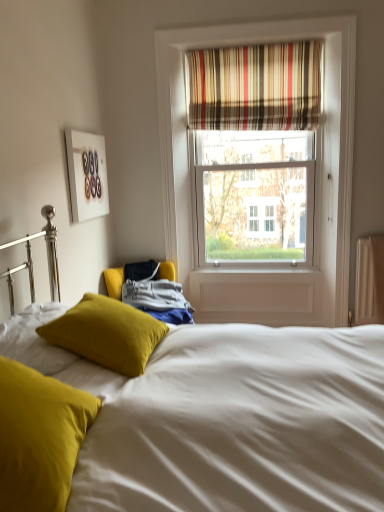
The height and width of the screenshot is (512, 384). What are the coordinates of `velvet mustard pillow at center, positioned as the 1th pillow in back-to-front order` in the screenshot? It's located at (107, 334).

Image resolution: width=384 pixels, height=512 pixels. Describe the element at coordinates (255, 87) in the screenshot. I see `striped fabric curtain at upper center` at that location.

What are the coordinates of `striped fabric curtain at upper center` in the screenshot? It's located at (255, 87).

At what (x,y) coordinates should I click in order to perform the action: click on white matte picture frame at upper left. Please return your answer as a coordinate pair (x, y). The width and height of the screenshot is (384, 512). Looking at the image, I should click on (87, 175).

Does point (192, 58) lie in front of point (250, 424)?

No.

Considering the sizes of objects striped fabric curtain at upper center and velvet yellow pillow at center in the image provided, who is wider, striped fabric curtain at upper center or velvet yellow pillow at center?

Wider between the two is velvet yellow pillow at center.

From a real-world perspective, relative to velvet yellow pillow at center, is striped fabric curtain at upper center vertically above or below?

striped fabric curtain at upper center is situated higher than velvet yellow pillow at center in the real world.

What's the angular difference between striped fabric curtain at upper center and velvet yellow pillow at center's facing directions?

The angular difference between striped fabric curtain at upper center and velvet yellow pillow at center is 89.6 degrees.

From a real-world perspective, is white matte picture frame at upper left physically below velvet mustard pillow at center, positioned as the 1th pillow in back-to-front order?

No, from a real-world perspective, white matte picture frame at upper left is not under velvet mustard pillow at center, positioned as the 1th pillow in back-to-front order.

In the scene shown: Considering the positions of objects white matte picture frame at upper left and velvet mustard pillow at center, positioned as the 1th pillow in back-to-front order, in the image provided, who is behind, white matte picture frame at upper left or velvet mustard pillow at center, positioned as the 1th pillow in back-to-front order,?

white matte picture frame at upper left.

Does point (83, 214) come behind point (100, 323)?

Yes, it is.

Between white matte picture frame at upper left and velvet mustard pillow at center, positioned as the 1th pillow in back-to-front order, which one has smaller size?

With smaller size is white matte picture frame at upper left.

Find the location of a particular element. curtain that is on the right side of velvet yellow pillow at center is located at coordinates (255, 87).

Which object is closer to the camera, velvet yellow pillow at center or striped fabric curtain at upper center?

velvet yellow pillow at center is in front.

Are velvet yellow pillow at center and striped fabric curtain at upper center beside each other?

velvet yellow pillow at center is not next to striped fabric curtain at upper center, and they're not touching.

From the image's perspective, who appears lower, matte yellow pillow at lower left, the first pillow when ordered from front to back, or striped fabric curtain at upper center?

matte yellow pillow at lower left, the first pillow when ordered from front to back, appears lower in the image.

Is matte yellow pillow at lower left, the 2th pillow in the back-to-front sequence, in front of or behind striped fabric curtain at upper center in the image?

Visually, matte yellow pillow at lower left, the 2th pillow in the back-to-front sequence, is located in front of striped fabric curtain at upper center.

This screenshot has width=384, height=512. There is a striped fabric curtain at upper center. Identify the location of the 2nd pillow below it (from the image's perspective). (x=39, y=437).

Is matte yellow pillow at lower left, the 2th pillow in the back-to-front sequence, at the left side of striped fabric curtain at upper center?

Correct, you'll find matte yellow pillow at lower left, the 2th pillow in the back-to-front sequence, to the left of striped fabric curtain at upper center.

Is point (321, 85) behind point (92, 194)?

Yes, point (321, 85) is behind point (92, 194).

Considering the relative sizes of striped fabric curtain at upper center and white matte picture frame at upper left in the image provided, is striped fabric curtain at upper center wider than white matte picture frame at upper left?

Correct, the width of striped fabric curtain at upper center exceeds that of white matte picture frame at upper left.

Who is more distant, striped fabric curtain at upper center or white matte picture frame at upper left?

striped fabric curtain at upper center is further from the camera.

Consider the image. Which is correct: striped fabric curtain at upper center is inside white matte picture frame at upper left, or outside of it?

striped fabric curtain at upper center cannot be found inside white matte picture frame at upper left.

This screenshot has width=384, height=512. What are the coordinates of `picture frame that appears above the matte yellow pillow at lower left, the 2th pillow in the back-to-front sequence (from the image's perspective)` in the screenshot? It's located at (87, 175).

Is matte yellow pillow at lower left, the 2th pillow in the back-to-front sequence, aimed at white matte picture frame at upper left?

No, matte yellow pillow at lower left, the 2th pillow in the back-to-front sequence, is not turned towards white matte picture frame at upper left.

Which of these two, matte yellow pillow at lower left, the 2th pillow in the back-to-front sequence, or white matte picture frame at upper left, is smaller?

With smaller size is white matte picture frame at upper left.

From the image's perspective, is matte yellow pillow at lower left, the 2th pillow in the back-to-front sequence, under white matte picture frame at upper left?

Indeed, from the image's perspective, matte yellow pillow at lower left, the 2th pillow in the back-to-front sequence, is shown beneath white matte picture frame at upper left.

Identify the location of the 1st pillow in front when counting from the striped fabric curtain at upper center. This screenshot has height=512, width=384. (107, 334).

Considering the sizes of objects velvet mustard pillow at center, positioned as the 1th pillow in back-to-front order, and striped fabric curtain at upper center in the image provided, who is bigger, velvet mustard pillow at center, positioned as the 1th pillow in back-to-front order, or striped fabric curtain at upper center?

With larger size is striped fabric curtain at upper center.

Is velvet mustard pillow at center, which is the 2th pillow from front to back, thinner than striped fabric curtain at upper center?

No, velvet mustard pillow at center, which is the 2th pillow from front to back, is not thinner than striped fabric curtain at upper center.

Locate an element on the screen. The image size is (384, 512). bed lying in front of the striped fabric curtain at upper center is located at coordinates (226, 418).

The height and width of the screenshot is (512, 384). Find the location of `picture frame that is above the velvet mustard pillow at center, which is the 2th pillow from front to back (from the image's perspective)`. picture frame that is above the velvet mustard pillow at center, which is the 2th pillow from front to back (from the image's perspective) is located at coordinates (87, 175).

Looking at the image, which one is located further to velvet mustard pillow at center, which is the 2th pillow from front to back, striped fabric curtain at upper center or matte yellow pillow at lower left, the 2th pillow in the back-to-front sequence?

striped fabric curtain at upper center is further to velvet mustard pillow at center, which is the 2th pillow from front to back.

Considering their positions, is white matte picture frame at upper left positioned closer to matte yellow pillow at lower left, the 2th pillow in the back-to-front sequence, than velvet mustard pillow at center, which is the 2th pillow from front to back?

Among the two, velvet mustard pillow at center, which is the 2th pillow from front to back, is located nearer to matte yellow pillow at lower left, the 2th pillow in the back-to-front sequence.

When comparing their distances from velvet mustard pillow at center, which is the 2th pillow from front to back, does striped fabric curtain at upper center or white matte picture frame at upper left seem further?

Based on the image, striped fabric curtain at upper center appears to be further to velvet mustard pillow at center, which is the 2th pillow from front to back.

Looking at the image, which one is located closer to velvet yellow pillow at center, matte yellow pillow at lower left, the 2th pillow in the back-to-front sequence, or striped fabric curtain at upper center?

Among the two, matte yellow pillow at lower left, the 2th pillow in the back-to-front sequence, is located nearer to velvet yellow pillow at center.

Looking at this image, from the image, which object appears to be farther from velvet yellow pillow at center, velvet mustard pillow at center, which is the 2th pillow from front to back, or striped fabric curtain at upper center?

Among the two, striped fabric curtain at upper center is located further to velvet yellow pillow at center.

When comparing their distances from white matte picture frame at upper left, does velvet yellow pillow at center or matte yellow pillow at lower left, the 2th pillow in the back-to-front sequence, seem closer?

velvet yellow pillow at center.

Based on their spatial positions, is velvet mustard pillow at center, which is the 2th pillow from front to back, or matte yellow pillow at lower left, the first pillow when ordered from front to back, closer to striped fabric curtain at upper center?

Among the two, velvet mustard pillow at center, which is the 2th pillow from front to back, is located nearer to striped fabric curtain at upper center.

From the picture: Considering their positions, is white matte picture frame at upper left positioned closer to striped fabric curtain at upper center than velvet yellow pillow at center?

white matte picture frame at upper left is positioned closer to the anchor striped fabric curtain at upper center.

The width and height of the screenshot is (384, 512). In order to click on picture frame between striped fabric curtain at upper center and velvet mustard pillow at center, which is the 2th pillow from front to back, vertically in this screenshot , I will do `click(87, 175)`.

This screenshot has width=384, height=512. In order to click on pillow between matte yellow pillow at lower left, the first pillow when ordered from front to back, and striped fabric curtain at upper center, along the z-axis in this screenshot , I will do `click(107, 334)`.

The image size is (384, 512). Find the location of `picture frame positioned between matte yellow pillow at lower left, the 2th pillow in the back-to-front sequence, and striped fabric curtain at upper center from near to far`. picture frame positioned between matte yellow pillow at lower left, the 2th pillow in the back-to-front sequence, and striped fabric curtain at upper center from near to far is located at coordinates (87, 175).

Where is `pillow between matte yellow pillow at lower left, the 2th pillow in the back-to-front sequence, and white matte picture frame at upper left from front to back`? pillow between matte yellow pillow at lower left, the 2th pillow in the back-to-front sequence, and white matte picture frame at upper left from front to back is located at coordinates (107, 334).